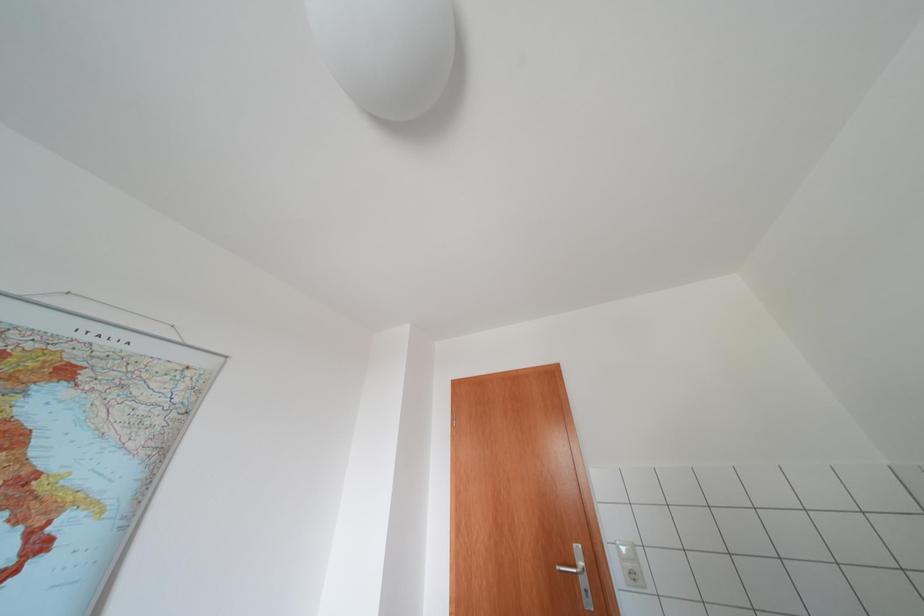
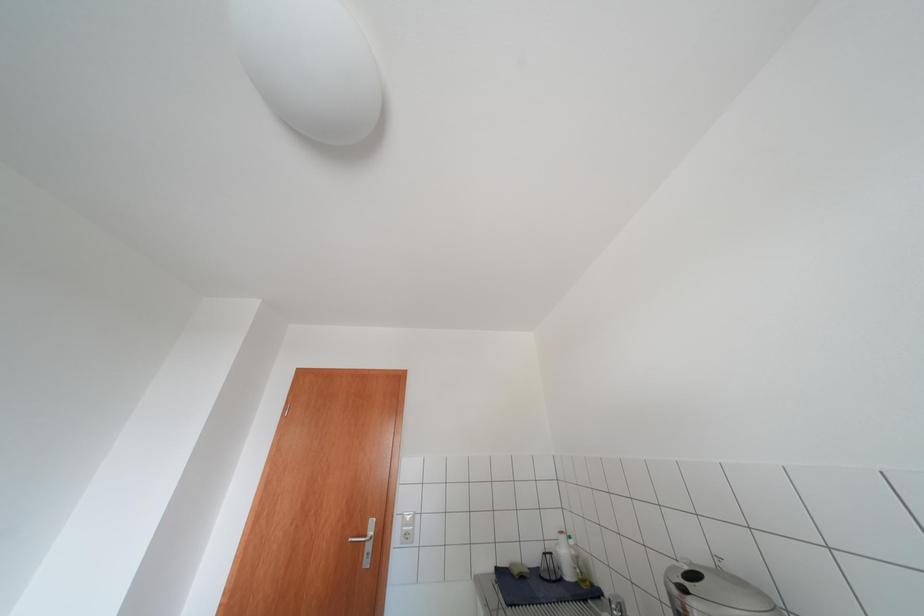
Question: Based on the continuous images, in which direction is the camera rotating? Reply with the corresponding letter.

Choices:
 (A) Left
 (B) Right
 (C) Up
 (D) Down

Answer: (B)